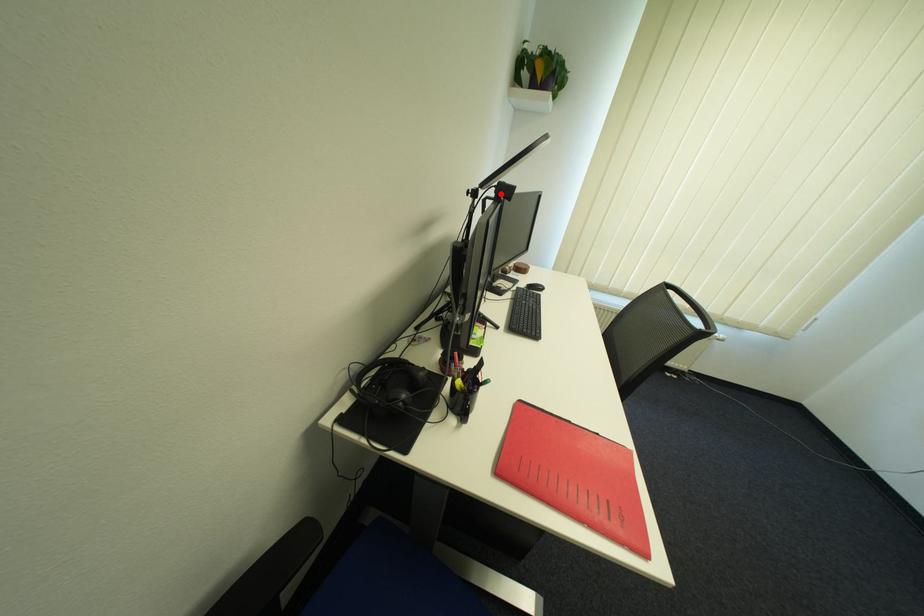
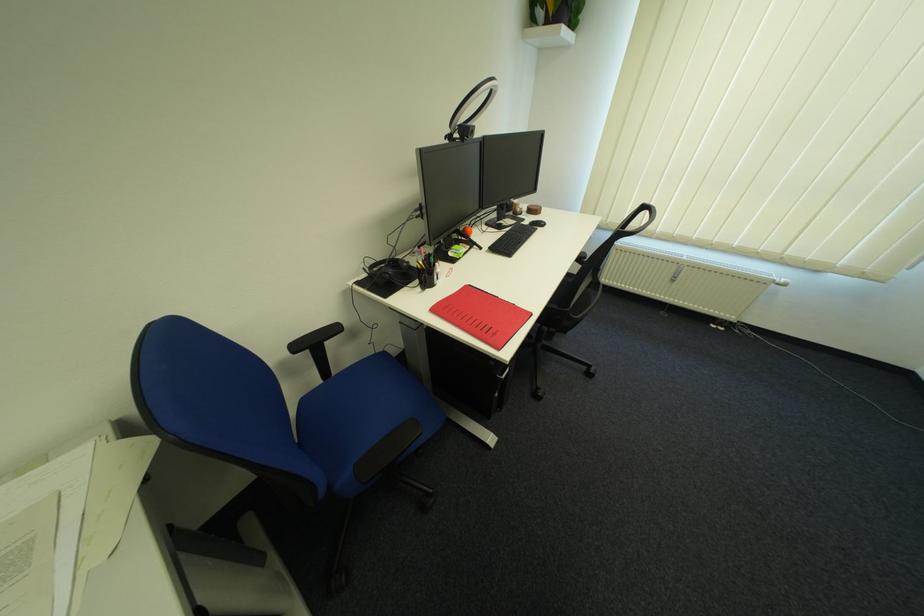
Where in the second image is the point corresponding to the highlighted location from the first image?

(467, 136)